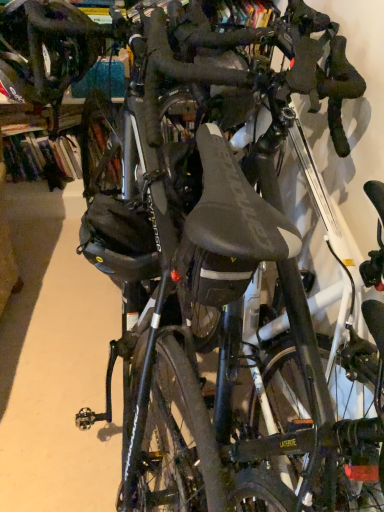
Find the location of a particular element. This screenshot has height=512, width=384. vacant region below matte black helmet at upper left (from a real-world perspective) is located at coordinates (67, 268).